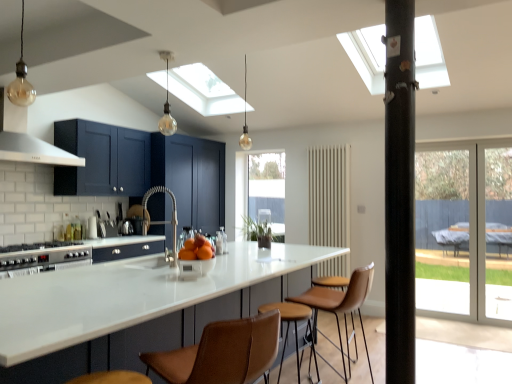
Question: In terms of height, does satin nickel faucet at center look taller or shorter compared to orangesmoothbowl at center?

Choices:
 (A) tall
 (B) short

Answer: (A)

Question: Is satin nickel faucet at center situated inside orangesmoothbowl at center or outside?

Choices:
 (A) inside
 (B) outside

Answer: (B)

Question: Estimate the real-world distances between objects in this image. Which object is farther from the matte blue cabinets at center?

Choices:
 (A) matte glass bulb at upper left, which is the third light fixture from right to left
 (B) transparent glass screen door at right, which ranks as the first screen door in left-to-right order
 (C) silver metallic stove at lower left
 (D) satin nickel faucet at center
 (E) brown leather chair at center, which is the 2th chair from back to front

Answer: (E)

Question: Considering the real-world distances, which object is closest to the matte glass bulb at upper left, marked as the third light fixture in a back-to-front arrangement?

Choices:
 (A) satin nickel faucet at center
 (B) white glossy countertop at center
 (C) transparent glass screen door at right, the 2th screen door in the left-to-right sequence
 (D) translucent glass bulb at upper center, acting as the second light fixture starting from the left
 (E) clear glass window at center

Answer: (A)